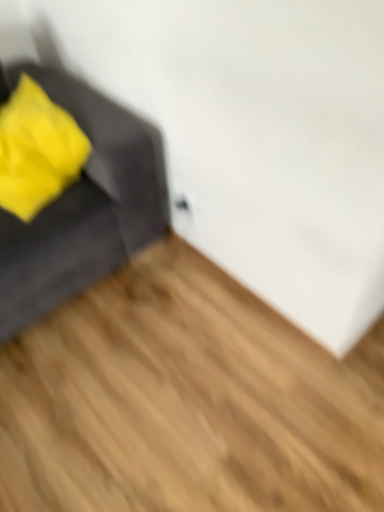
Question: Would you say soft yellow fabric at left is a long distance from light brown wood flooring at lower left?

Choices:
 (A) no
 (B) yes

Answer: (A)

Question: Does soft yellow fabric at left come behind light brown wood flooring at lower left?

Choices:
 (A) yes
 (B) no

Answer: (A)

Question: Is soft yellow fabric at left looking in the opposite direction of light brown wood flooring at lower left?

Choices:
 (A) no
 (B) yes

Answer: (A)

Question: Does soft yellow fabric at left appear on the left side of light brown wood flooring at lower left?

Choices:
 (A) yes
 (B) no

Answer: (A)

Question: Is soft yellow fabric at left thinner than light brown wood flooring at lower left?

Choices:
 (A) no
 (B) yes

Answer: (B)

Question: Is light brown wood flooring at lower left wider or thinner than soft yellow fabric at left?

Choices:
 (A) wide
 (B) thin

Answer: (A)

Question: From the image's perspective, is light brown wood flooring at lower left positioned above or below soft yellow fabric at left?

Choices:
 (A) below
 (B) above

Answer: (A)

Question: Looking at the image, does light brown wood flooring at lower left seem bigger or smaller compared to soft yellow fabric at left?

Choices:
 (A) big
 (B) small

Answer: (A)

Question: Visually, is light brown wood flooring at lower left positioned to the left or to the right of soft yellow fabric at left?

Choices:
 (A) right
 (B) left

Answer: (A)

Question: In terms of width, does soft yellow fabric at left look wider or thinner when compared to velvet gray sofa at left?

Choices:
 (A) thin
 (B) wide

Answer: (A)

Question: Would you say soft yellow fabric at left is to the left or to the right of velvet gray sofa at left in the picture?

Choices:
 (A) right
 (B) left

Answer: (A)

Question: In terms of size, does soft yellow fabric at left appear bigger or smaller than velvet gray sofa at left?

Choices:
 (A) big
 (B) small

Answer: (B)

Question: Considering the positions of soft yellow fabric at left and velvet gray sofa at left in the image, is soft yellow fabric at left taller or shorter than velvet gray sofa at left?

Choices:
 (A) short
 (B) tall

Answer: (A)

Question: In terms of width, does velvet gray sofa at left look wider or thinner when compared to soft yellow fabric at left?

Choices:
 (A) wide
 (B) thin

Answer: (A)

Question: From the image's perspective, is velvet gray sofa at left located above or below soft yellow fabric at left?

Choices:
 (A) below
 (B) above

Answer: (A)